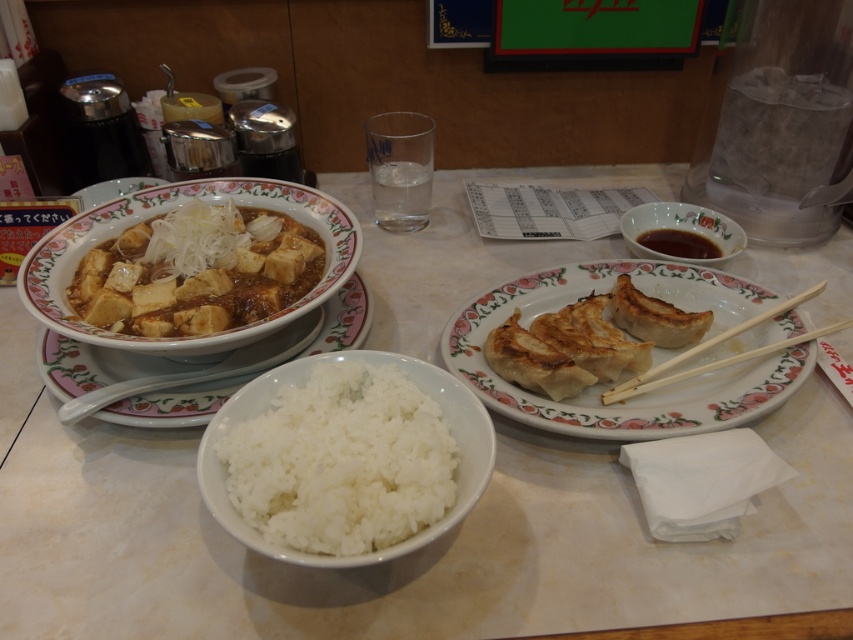
You are a server at the restaurant and need to place a 16 inch long serving tray on the table. The tray must be placed between the white glossy rice bowl at lower center and the edge of the table closest to the viewer. Is there enough space for the tray?

The white glossy rice bowl at lower center is 16.14 inches away from the viewer. Since the serving tray is 16 inches long, there is sufficient space between the bowl and the table edge to accommodate it as the distance is slightly longer than the tray.

You are a diner at the restaurant and want to eat the matte brown tofu at center using the wooden chopsticks at right. Can you reach the tofu with the chopsticks without moving either?

The matte brown tofu at center is in front of the wooden chopsticks at right, so yes, you can reach the tofu with the chopsticks without moving either since they are aligned along the same line of sight.

You are a diner at this restaurant and want to eat the matte brown tofu at center. The wooden chopsticks at right are 15 cm long. Can you pick up the tofu with them?

The matte brown tofu at center is taller than wooden chopsticks at right. Since the tofu is taller than the chopsticks, it might be difficult to pick it up with the 15 cm chopsticks as they may not provide enough length to grip and lift the taller item effectively.